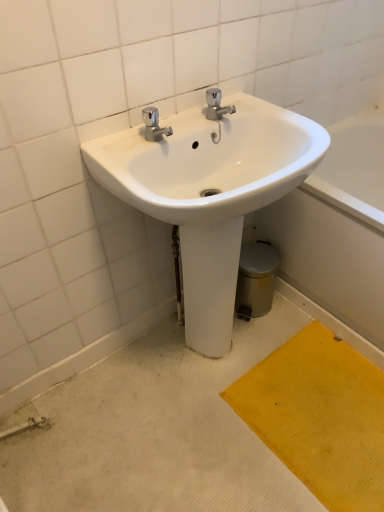
Identify the location of free region under white glossy sink at center (from a real-world perspective). (207, 361).